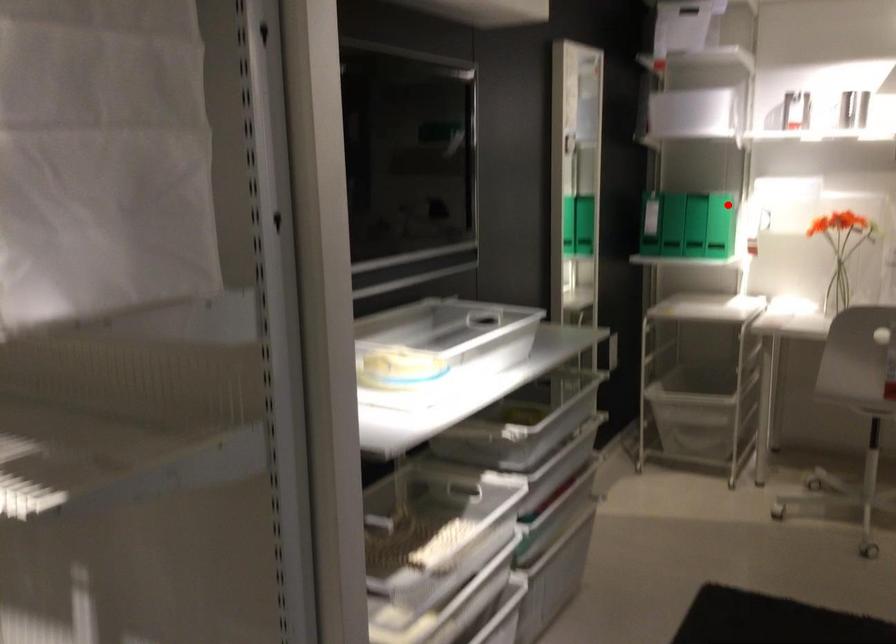
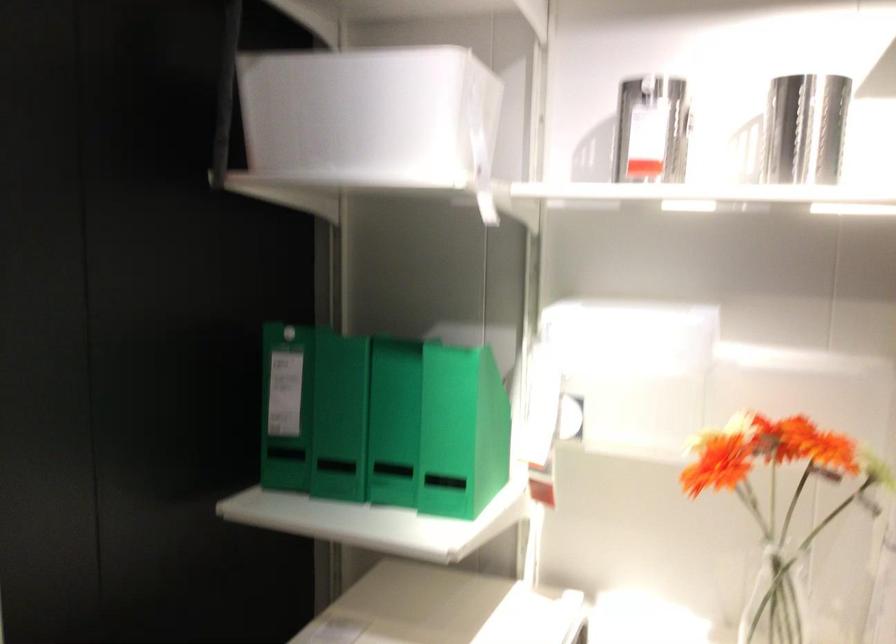
Question: I am providing you with two images of the same scene from different viewpoints. A red point is marked on the first image. At the location where the point appears in image 1, is it still visible in image 2?

Choices:
 (A) Yes
 (B) No

Answer: (A)